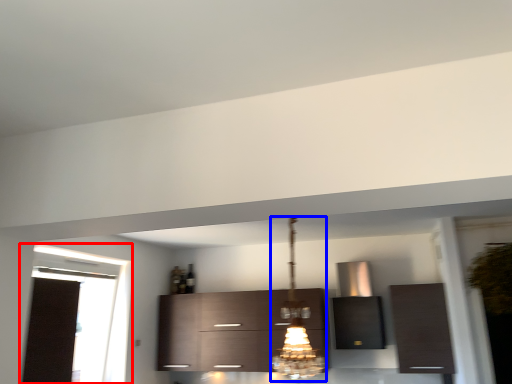
Question: Which of the following is the farthest to the observer, window (highlighted by a red box) or light fixture (highlighted by a blue box)?

Choices:
 (A) window
 (B) light fixture

Answer: (A)